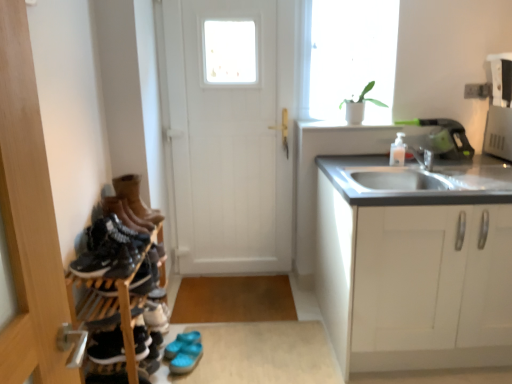
Question: Can you confirm if matte black sneaker at left, which is the 3th shoe from front to back, is smaller than wooden shoe rack at left?

Choices:
 (A) no
 (B) yes

Answer: (B)

Question: Is matte black sneaker at left, the 2th shoe from the bottom, surrounding wooden shoe rack at left?

Choices:
 (A) no
 (B) yes

Answer: (A)

Question: Is matte black sneaker at left, positioned as the 1th shoe in back-to-front order, positioned before wooden shoe rack at left?

Choices:
 (A) no
 (B) yes

Answer: (A)

Question: Considering the relative sizes of matte black sneaker at left, the 2th shoe viewed from the top, and wooden shoe rack at left in the image provided, is matte black sneaker at left, the 2th shoe viewed from the top, bigger than wooden shoe rack at left?

Choices:
 (A) no
 (B) yes

Answer: (A)

Question: Are matte black sneaker at left, positioned as the 1th shoe in back-to-front order, and wooden shoe rack at left far apart?

Choices:
 (A) yes
 (B) no

Answer: (B)

Question: Would you say leather boots at left, arranged as the 4th footwear when ordered from the bottom, is to the left or to the right of leather boots at left, the third footwear in the bottom-to-top sequence, in the picture?

Choices:
 (A) left
 (B) right

Answer: (B)

Question: Is leather boots at left, which is the third footwear from front to back, in front of or behind leather boots at left, marked as the second footwear in a front-to-back arrangement, in the image?

Choices:
 (A) front
 (B) behind

Answer: (B)

Question: From the image's perspective, is leather boots at left, acting as the 1th footwear starting from the top, positioned above or below leather boots at left, which ranks as the 3th footwear in back-to-front order?

Choices:
 (A) below
 (B) above

Answer: (B)

Question: Considering the positions of point (131, 190) and point (136, 221), is point (131, 190) closer or farther from the camera than point (136, 221)?

Choices:
 (A) farther
 (B) closer

Answer: (A)

Question: From their relative heights in the image, would you say white matte cabinet at right is taller or shorter than black leather shoe at left, acting as the 3th shoe starting from the top?

Choices:
 (A) tall
 (B) short

Answer: (A)

Question: Is white matte cabinet at right to the left or to the right of black leather shoe at left, the first shoe when ordered from bottom to top, in the image?

Choices:
 (A) right
 (B) left

Answer: (A)

Question: Considering the positions of white matte cabinet at right and black leather shoe at left, positioned as the 2th shoe in back-to-front order, in the image, is white matte cabinet at right wider or thinner than black leather shoe at left, positioned as the 2th shoe in back-to-front order,?

Choices:
 (A) thin
 (B) wide

Answer: (B)

Question: Relative to black leather shoe at left, the first shoe when ordered from bottom to top, is white matte cabinet at right in front or behind?

Choices:
 (A) front
 (B) behind

Answer: (B)

Question: From the image's perspective, is leather boots at left, which is the third footwear from front to back, above or below black matte shoe at left, positioned as the 1th shoe in front-to-back order?

Choices:
 (A) above
 (B) below

Answer: (A)

Question: Is leather boots at left, which appears as the second footwear when viewed from the back, wider or thinner than black matte shoe at left, positioned as the 1th shoe in front-to-back order?

Choices:
 (A) wide
 (B) thin

Answer: (A)